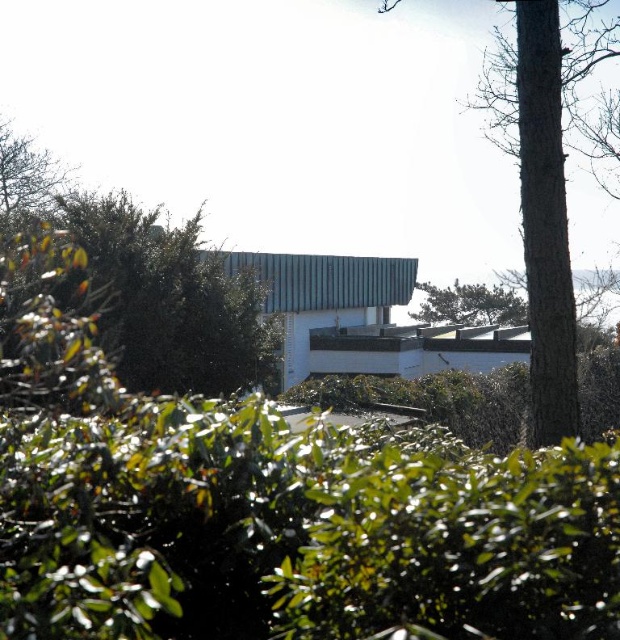
You are a landscape architect designing a new garden. You have two trees to place in the design. The brown textured tree at center and the green leafy tree at upper center. Which tree should you place in a position where height is a concern because it is taller?

The brown textured tree at center is taller than the green leafy tree at upper center, so it should be placed in the position where height is a concern.

You are a landscape architect designing a garden pathway that needs to pass between the brown textured tree at center and the green leafy tree at upper center. Based on their positions, which tree should the pathway be closer to in order to avoid the taller tree?

The brown textured tree at center is located above the green leafy tree at upper center, so the pathway should be closer to the green leafy tree at upper center to avoid the taller tree.

Based on the scene description, where is the brown textured tree at center located in terms of coordinates?

The brown textured tree at center is located at point coordinates of (x=546, y=180).